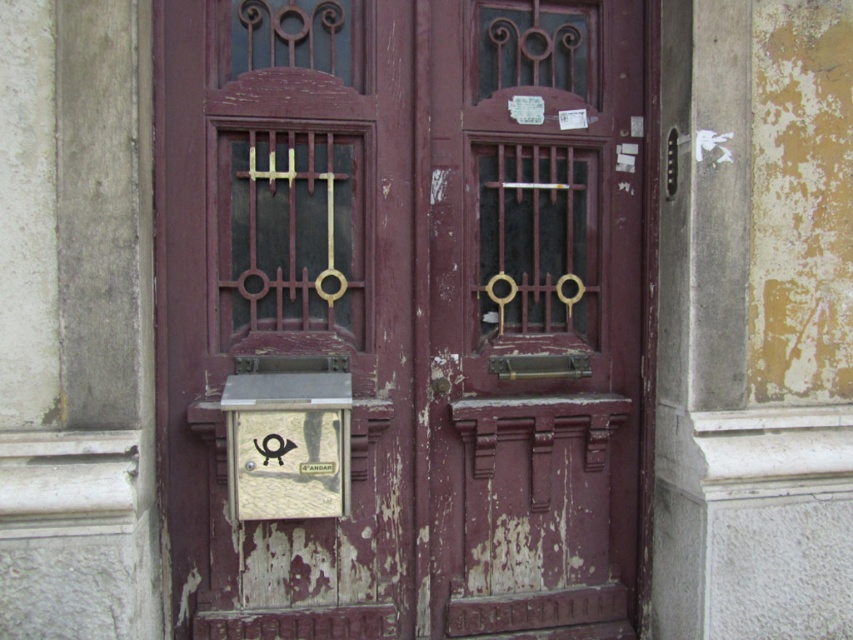
Question: Which point is closer to the camera?

Choices:
 (A) gold textured plaque at center
 (B) rusty wood door at center

Answer: (B)

Question: Is rusty metal door at center behind gold textured plaque at center?

Choices:
 (A) yes
 (B) no

Answer: (A)

Question: Is rusty wood door at center to the right of rusty metal door at center from the viewer's perspective?

Choices:
 (A) no
 (B) yes

Answer: (A)

Question: Which of the following is the farthest from the observer?

Choices:
 (A) (643, 516)
 (B) (547, 74)
 (C) (341, 449)

Answer: (A)

Question: Estimate the real-world distances between objects in this image. Which object is closer to the rusty metal door at center?

Choices:
 (A) rusty wood door at center
 (B) gold textured plaque at center

Answer: (A)

Question: Can you confirm if rusty wood door at center is positioned to the right of gold textured plaque at center?

Choices:
 (A) no
 (B) yes

Answer: (B)